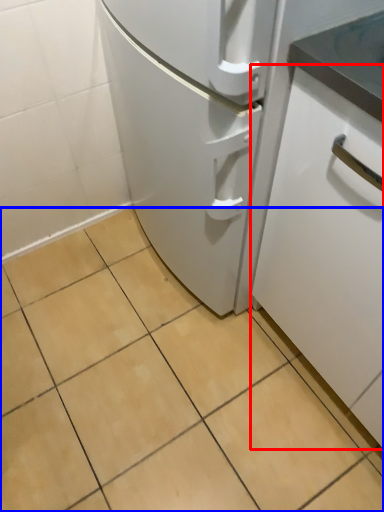
Question: Which object is closer to the camera taking this photo, cabinetry (highlighted by a red box) or ceramic tile (highlighted by a blue box)?

Choices:
 (A) cabinetry
 (B) ceramic tile

Answer: (A)